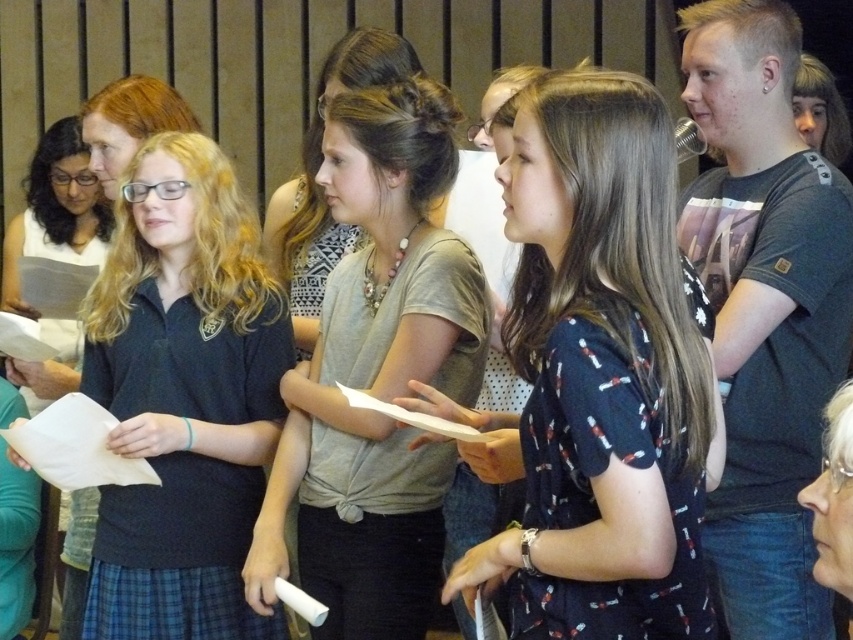
Question: Where is dark blue printed dress at center located in relation to matte black shirt at upper left in the image?

Choices:
 (A) above
 (B) below

Answer: (B)

Question: In this image, where is dark blue printed dress at center located relative to matte gray shirt at center?

Choices:
 (A) above
 (B) below

Answer: (A)

Question: Is matte gray shirt at center bigger than matte black shirt at upper left?

Choices:
 (A) no
 (B) yes

Answer: (A)

Question: Which of the following is the farthest from the observer?

Choices:
 (A) matte black shirt at upper left
 (B) dark blue printed dress at center
 (C) dark blue uniform at center

Answer: (A)

Question: Which object is closer to the camera taking this photo?

Choices:
 (A) matte black shirt at upper left
 (B) dark blue printed dress at center
 (C) matte gray shirt at center
 (D) dark blue uniform at center

Answer: (B)

Question: Which point is farther to the camera?

Choices:
 (A) (556, 628)
 (B) (13, 257)
 (C) (438, 186)
 (D) (126, 497)

Answer: (B)